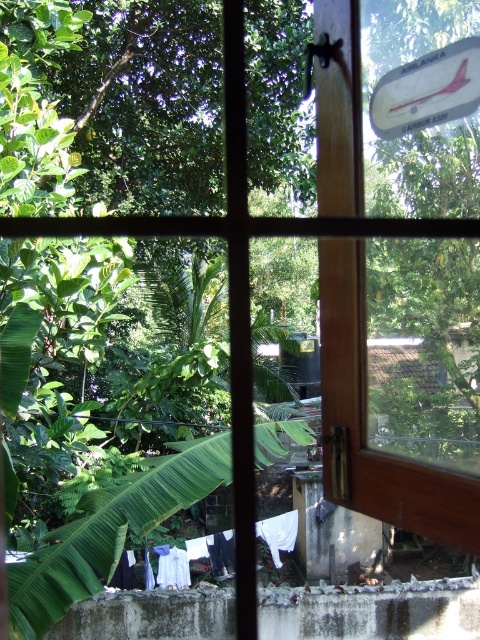
You are standing in a room and looking through the window shown in the scene. You want to know if you can reach the metallic reflective airplane at upper right from the white fabric at lower center in one step. Assuming your step can cover up to 10 meters, can you reach it?

The metallic reflective airplane at upper right is 11.69 meters away from the white fabric at lower center. Since your step can only cover up to 10 meters, you cannot reach the metallic reflective airplane at upper right from the white fabric at lower center in one step.

You are standing in a room looking through the window shown in the image. There are two points marked on the window glass at coordinates point (393, 132) and point (272, 522). Which point is closer to you as you look through the window?

Point (393, 132) is closer to you because it is in front of point (272, 522).

You are standing in a room and looking through the window at the metallic reflective airplane at upper right. If you want to take a photo of it without any obstructions, is the distance sufficient for a clear shot?

The metallic reflective airplane at upper right is 3.80 feet away from camera, so yes, the distance is sufficient for a clear photo without obstructions.